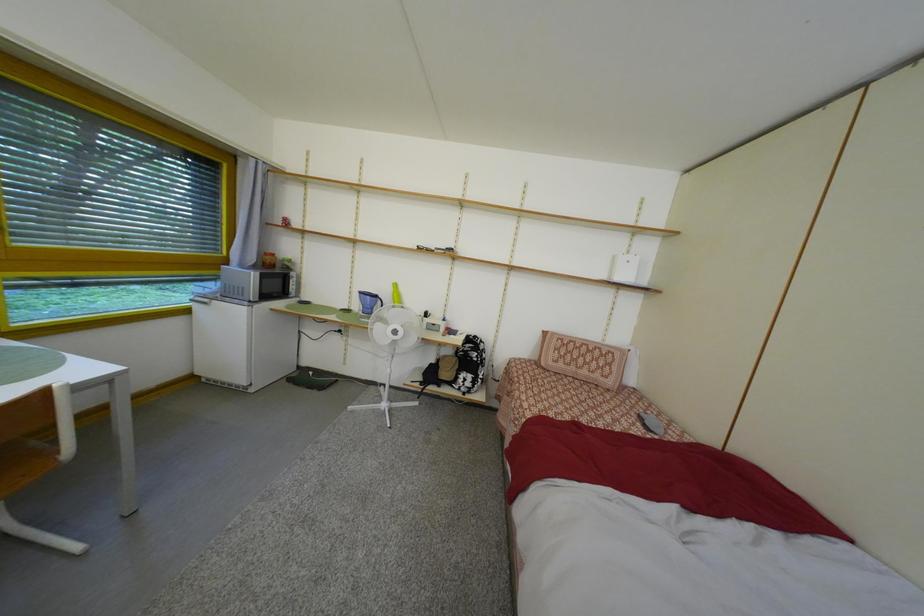
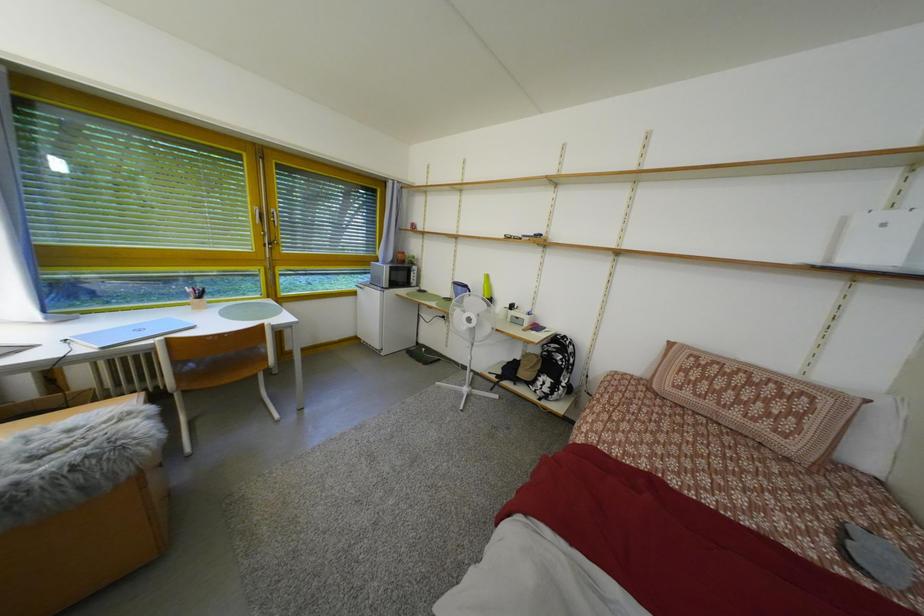
Question: The camera is either moving clockwise (left) or counter-clockwise (right) around the object. The first image is from the beginning of the video and the second image is from the end. Is the camera moving left or right when shooting the video?

Choices:
 (A) Left
 (B) Right

Answer: (B)